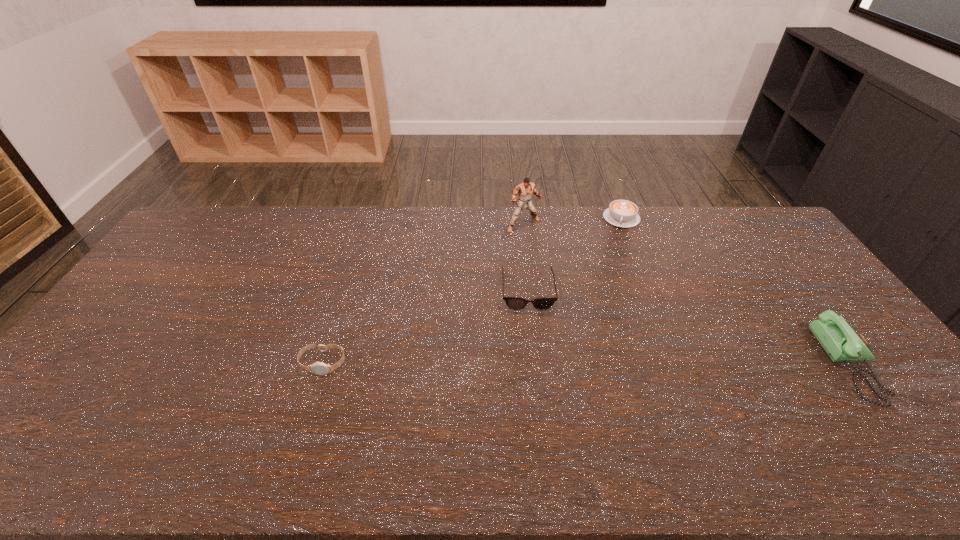
You are a GUI agent. You are given a task and a screenshot of the screen. Output one action in this format:
    pyautogui.click(x=<x>, y=<y>)
    Task: Click on the object that is at the near right corner
    This screenshot has width=960, height=540.
    Given the screenshot: What is the action you would take?
    pyautogui.click(x=838, y=339)

At what (x,y) coordinates should I click in order to perform the action: click on vacant space at the far edge of the desktop. Please return your answer as a coordinate pair (x, y). The image size is (960, 540). Looking at the image, I should click on (432, 229).

The width and height of the screenshot is (960, 540). Identify the location of vacant space at the near edge of the desktop. point(830,422).

In the image, there is a desktop. Where is `vacant space at the left edge`? This screenshot has width=960, height=540. vacant space at the left edge is located at coordinates (162, 311).

This screenshot has width=960, height=540. In the image, there is a desktop. What are the coordinates of `free region at the right edge` in the screenshot? It's located at (773, 268).

At what (x,y) coordinates should I click in order to perform the action: click on vacant position at the far left corner of the desktop. Please return your answer as a coordinate pair (x, y). This screenshot has height=540, width=960. Looking at the image, I should click on (215, 209).

This screenshot has width=960, height=540. What are the coordinates of `vacant area that lies between the second tallest object and the watch` in the screenshot? It's located at (587, 364).

At what (x,y) coordinates should I click in order to perform the action: click on empty location between the sunglasses and the leftmost object. Please return your answer as a coordinate pair (x, y). The image size is (960, 540). Looking at the image, I should click on (425, 327).

What are the coordinates of `vacant space that's between the tallest object and the cappuccino` in the screenshot? It's located at (572, 221).

Where is `vacant area that lies between the sunglasses and the fourth object from left to right`? vacant area that lies between the sunglasses and the fourth object from left to right is located at coordinates pos(574,254).